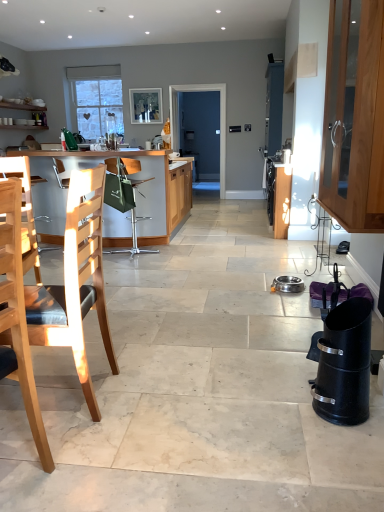
I want to click on vacant region in front of light wood chair at left, which is counted as the 2th chair, starting from the front, so click(65, 448).